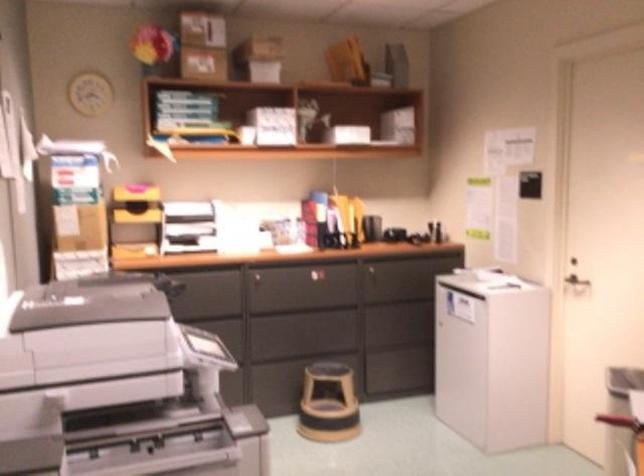
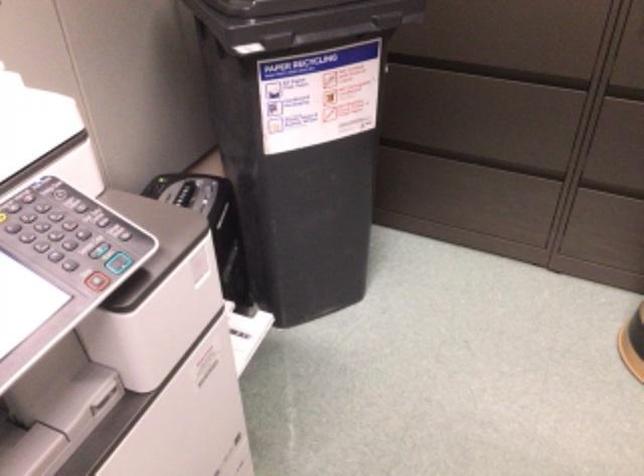
Where in the second image is the point corresponding to (x=205, y=326) from the first image?

(507, 73)